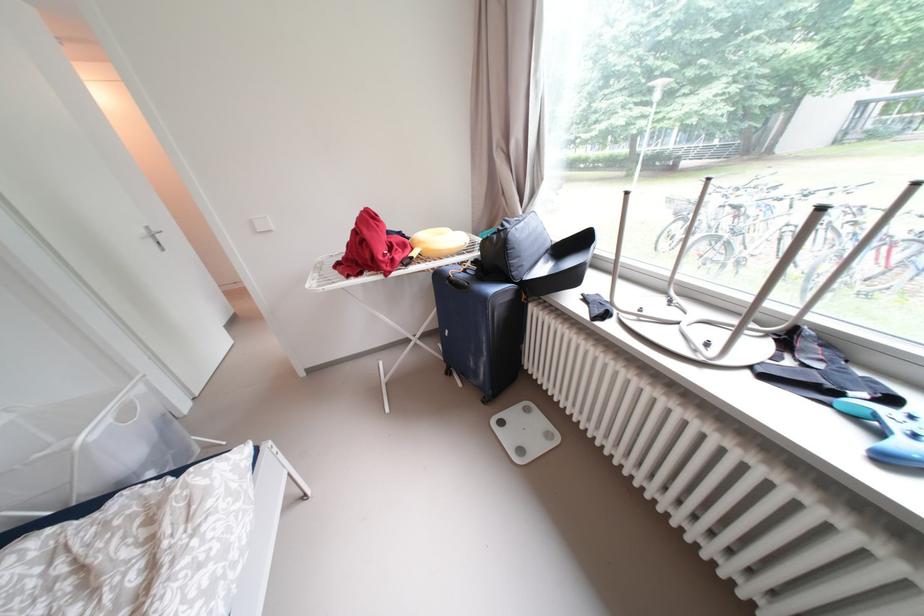
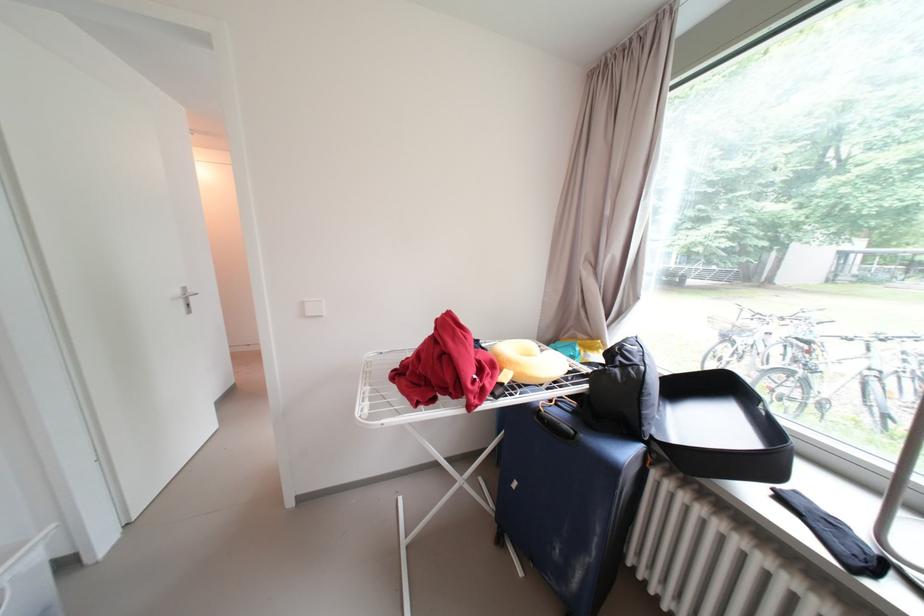
The point at (432, 246) is marked in the first image. Where is the corresponding point in the second image?

(527, 371)